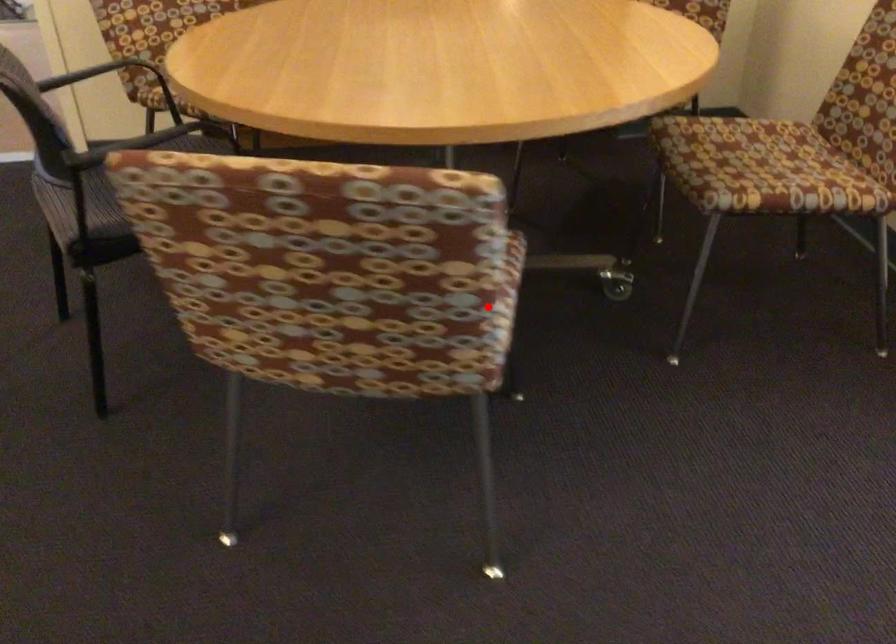
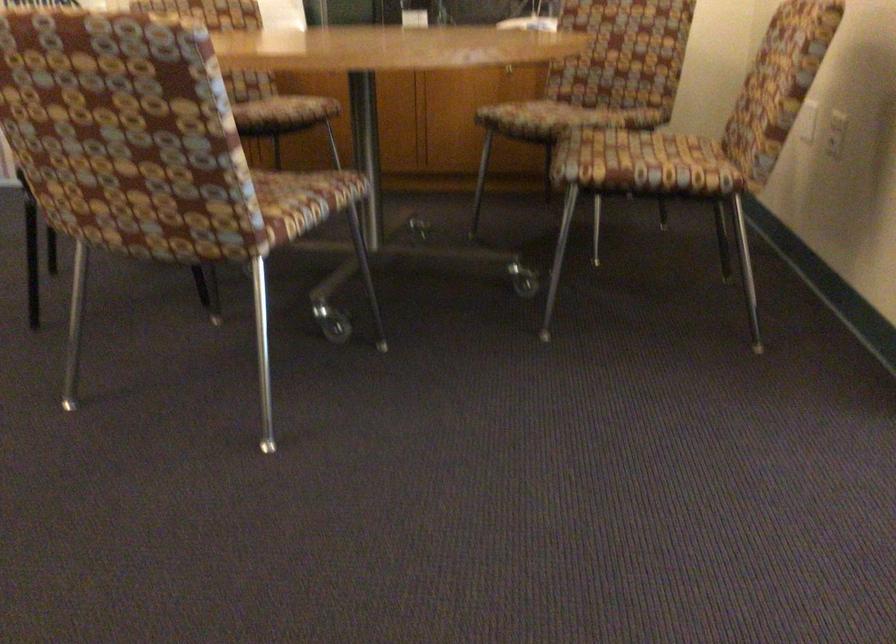
Question: I am providing you with two images of the same scene from different viewpoints. Given a red point in image1, look at the same physical point in image2. Is it:

Choices:
 (A) Closer to the viewpoint
 (B) Farther from the viewpoint

Answer: (B)